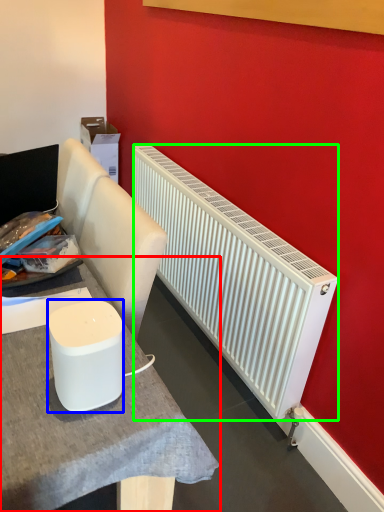
Question: Which object is positioned farthest from table (highlighted by a red box)? Select from appliance (highlighted by a blue box) and radiator (highlighted by a green box).

Choices:
 (A) appliance
 (B) radiator

Answer: (B)